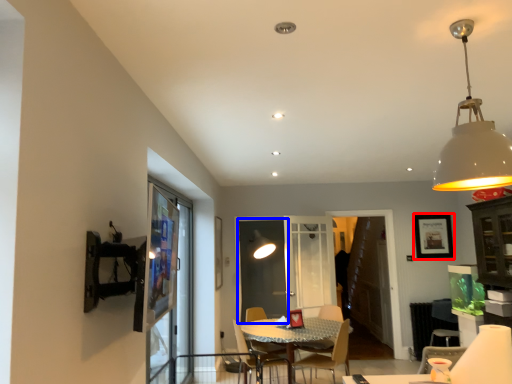
Question: Among these objects, which one is nearest to the camera, picture frame (highlighted by a red box) or screen door (highlighted by a blue box)?

Choices:
 (A) picture frame
 (B) screen door

Answer: (B)